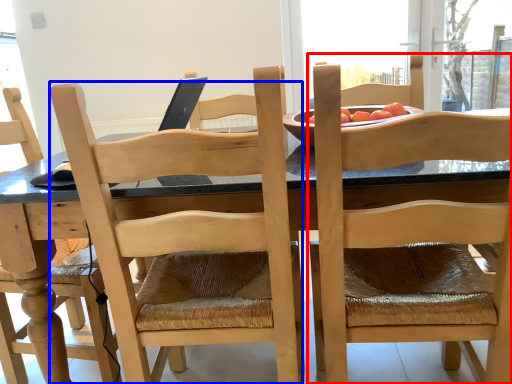
Question: Which object is closer to the camera taking this photo, chair (highlighted by a red box) or chair (highlighted by a blue box)?

Choices:
 (A) chair
 (B) chair

Answer: (A)